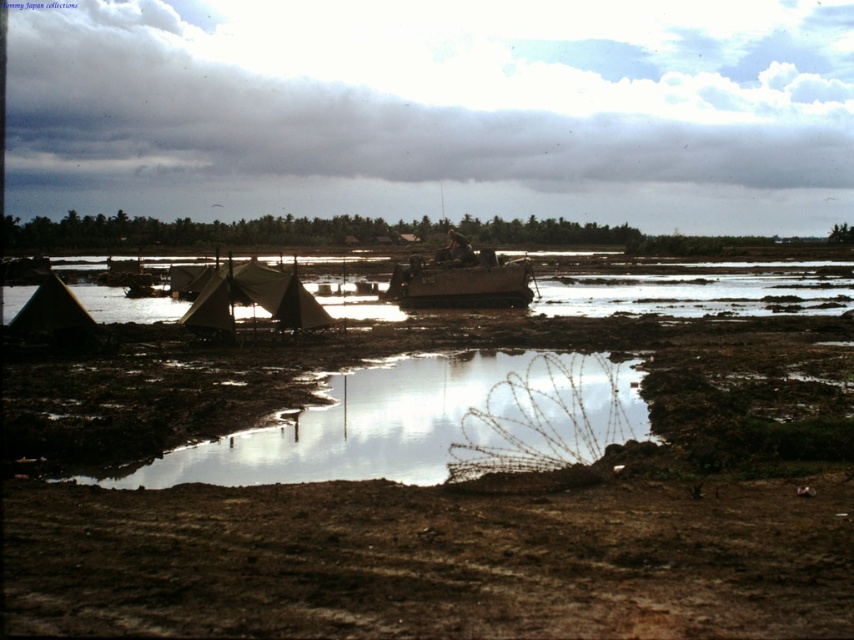
Is reflective mud puddle at center behind matte brown tent at lower left?

That is False.

Between point (439, 422) and point (67, 316), which one is positioned in front?

Point (439, 422)

At what (x,y) coordinates should I click in order to perform the action: click on reflective mud puddle at center. Please return your answer as a coordinate pair (x, y). The width and height of the screenshot is (854, 640). Looking at the image, I should click on (425, 422).

Who is higher up, brown muddy water at center or brown matte boat at center?

brown muddy water at center is higher up.

Is brown muddy water at center positioned behind brown matte boat at center?

That is False.

At what (x,y) coordinates should I click in order to perform the action: click on brown muddy water at center. Please return your answer as a coordinate pair (x, y). This screenshot has width=854, height=640. Looking at the image, I should click on (699, 289).

You are a GUI agent. You are given a task and a screenshot of the screen. Output one action in this format:
    pyautogui.click(x=<x>, y=<y>)
    Task: Click on the brown muddy water at center
    This screenshot has width=854, height=640.
    Given the screenshot: What is the action you would take?
    pyautogui.click(x=699, y=289)

Between brown soil at lower center and reflective mud puddle at center, which one has less height?

brown soil at lower center

Who is more forward, (126, 604) or (513, 422)?

Point (126, 604)

Find the location of a particular element. brown soil at lower center is located at coordinates (431, 560).

I want to click on brown soil at lower center, so click(431, 560).